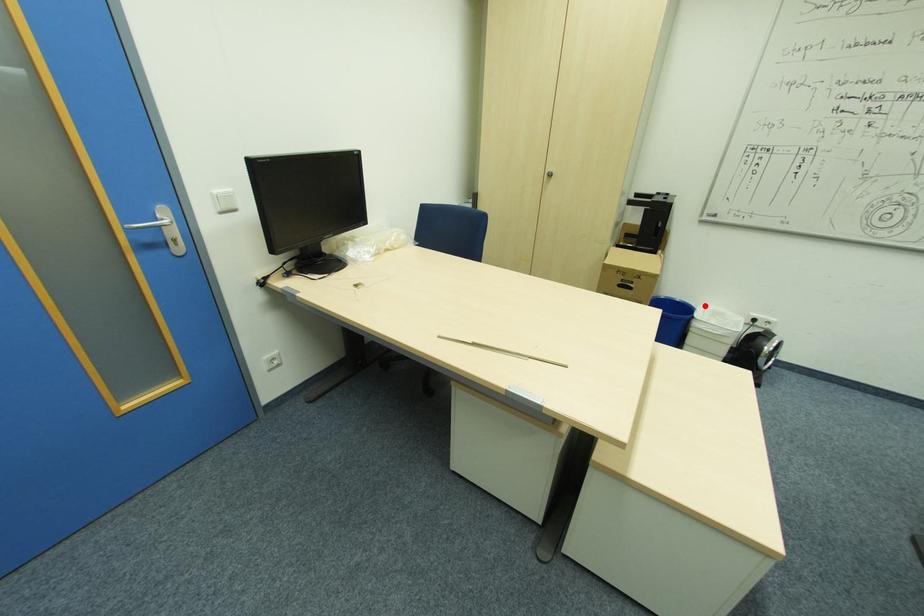
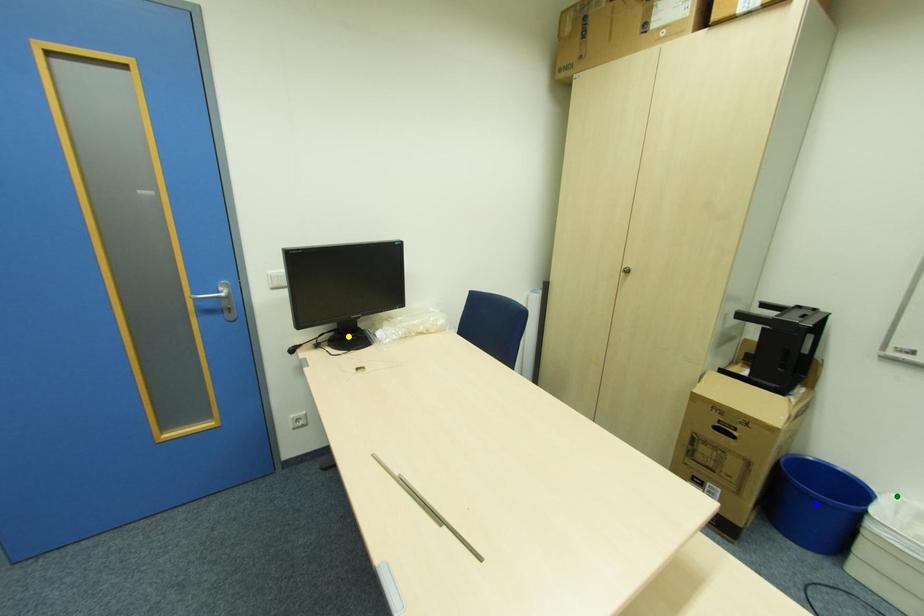
Question: I am providing you with two images of the same scene from different viewpoints. A red point is marked on the first image. You are given multiple points on the second image. Which point in image 2 is actually the same real-world point as the red point in image 1?

Choices:
 (A) yellow point
 (B) green point
 (C) blue point

Answer: (B)